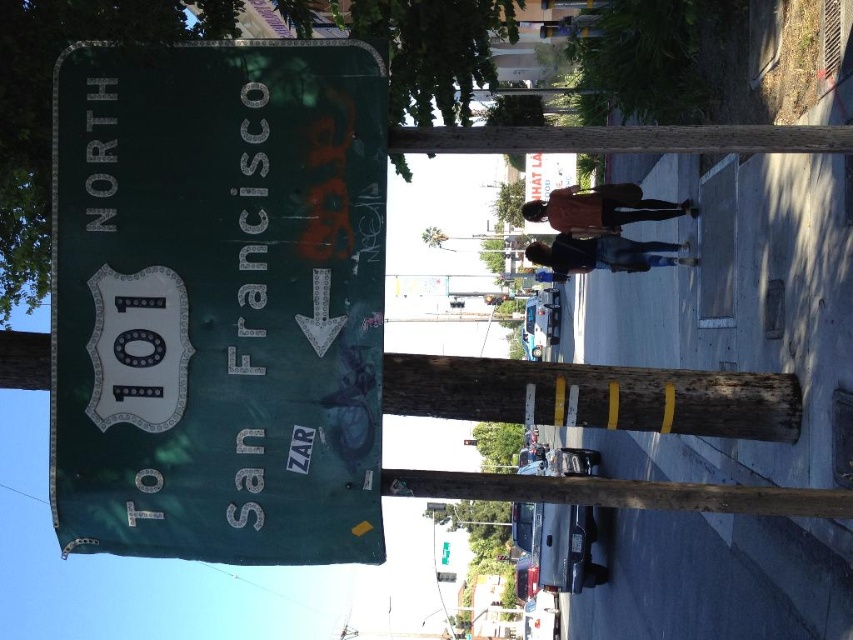
Question: Which is farther from the green matte sign at left?

Choices:
 (A) brown wooden pole at center
 (B) wooden post at center

Answer: (B)

Question: Is green matte sign at left smaller than wooden post at center?

Choices:
 (A) no
 (B) yes

Answer: (A)

Question: Which of the following is the closest to the observer?

Choices:
 (A) (440, 380)
 (B) (479, 134)

Answer: (B)

Question: Can you confirm if green matte sign at left is wider than brown wooden pole at center?

Choices:
 (A) no
 (B) yes

Answer: (A)

Question: Is green matte sign at left to the left of brown wooden pole at center from the viewer's perspective?

Choices:
 (A) yes
 (B) no

Answer: (A)

Question: Which point is farther from the camera taking this photo?

Choices:
 (A) 732,433
 (B) 553,150
 (C) 183,221

Answer: (A)